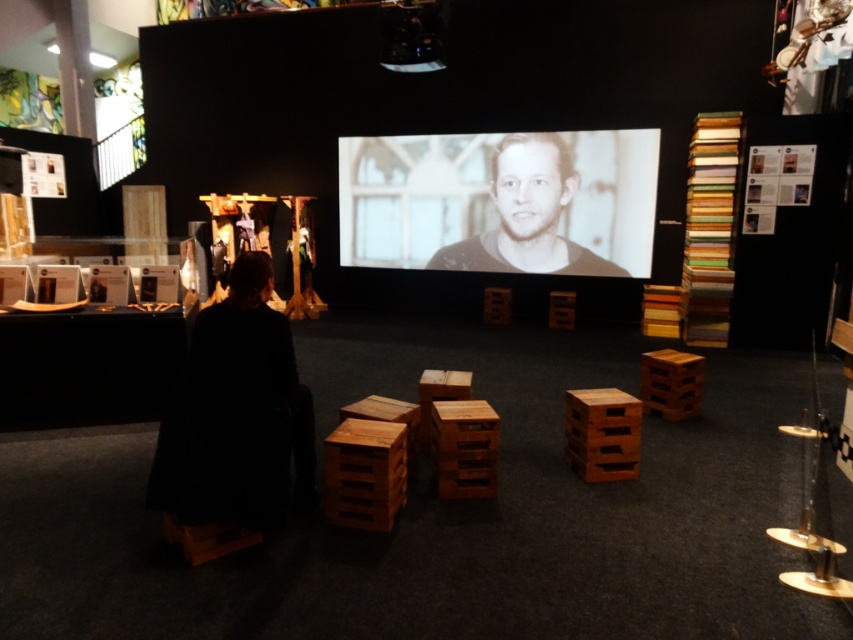
Is point (555, 164) in front of point (631, 467)?

No, (555, 164) is further to viewer.

Which is more to the left, black matte face at center or brown wooden crate at center?

brown wooden crate at center

Is point (560, 189) closer to viewer compared to point (595, 467)?

No, it is behind (595, 467).

Where is `black matte face at center`? black matte face at center is located at coordinates (527, 214).

Which is above, black matte face at center or rustic wood crate at center?

black matte face at center

Where is `black matte face at center`? Image resolution: width=853 pixels, height=640 pixels. black matte face at center is located at coordinates tap(527, 214).

Where is `black matte face at center`? black matte face at center is located at coordinates (527, 214).

Does rustic wood crate at center lie in front of brown wooden crate at center?

Yes, it is in front of brown wooden crate at center.

Does point (350, 488) come behind point (595, 404)?

No, (350, 488) is in front of (595, 404).

Between point (376, 502) and point (582, 456), which one is positioned in front?

Positioned in front is point (376, 502).

Find the location of a particular element. The height and width of the screenshot is (640, 853). rustic wood crate at center is located at coordinates click(x=364, y=474).